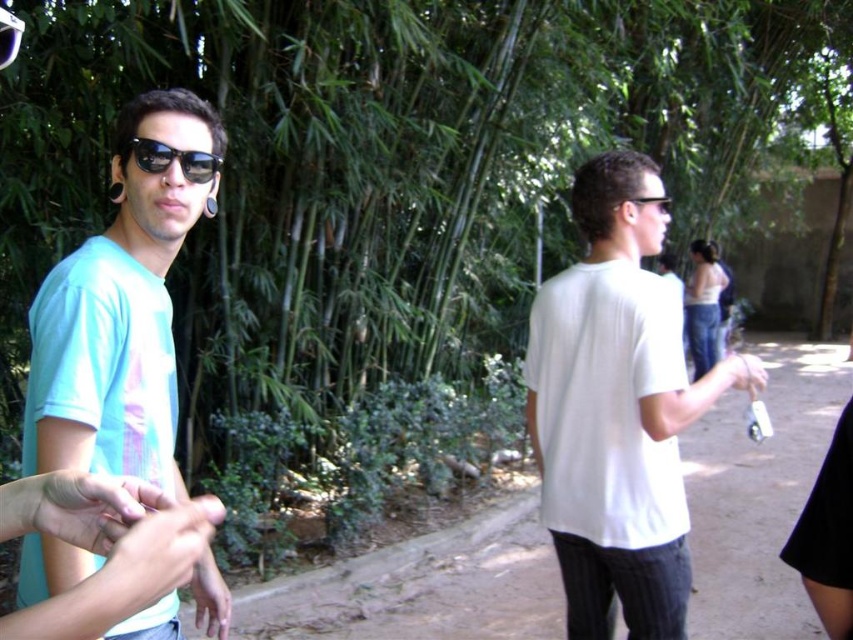
Does white matte shirt at center appear on the left side of white matte hand at center?

Yes, white matte shirt at center is to the left of white matte hand at center.

Does point (560, 520) lie in front of point (755, 378)?

No, it is not.

Locate an element on the screen. white matte shirt at center is located at coordinates (614, 412).

Is light blue t-shirt at left to the left of white matte hand at center from the viewer's perspective?

Yes, light blue t-shirt at left is to the left of white matte hand at center.

Based on the photo, is light blue t-shirt at left above white matte hand at center?

Yes.

Describe the element at coordinates (120, 310) in the screenshot. I see `light blue t-shirt at left` at that location.

Find the location of a particular element. This screenshot has width=853, height=640. light blue t-shirt at left is located at coordinates (120, 310).

I want to click on white matte shirt at center, so click(x=614, y=412).

Looking at this image, which is above, white matte shirt at center or black plastic sunglasses at upper center?

Positioned higher is black plastic sunglasses at upper center.

Which is in front, point (601, 557) or point (637, 202)?

Point (637, 202)

The width and height of the screenshot is (853, 640). Find the location of `white matte shirt at center`. white matte shirt at center is located at coordinates (614, 412).